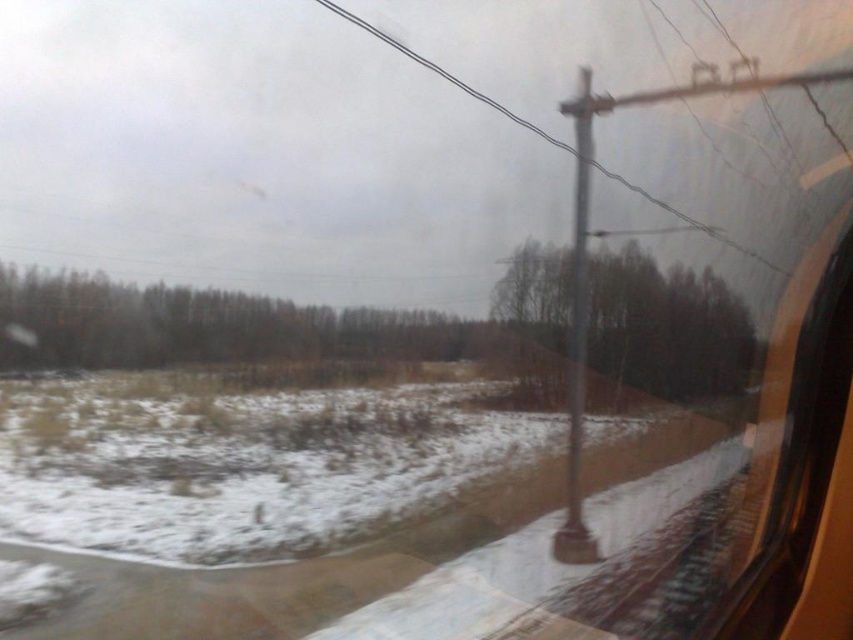
Question: Is green matte trees at center below metallic wire at center?

Choices:
 (A) no
 (B) yes

Answer: (B)

Question: Estimate the real-world distances between objects in this image. Which object is closer to the brown matte tree at center?

Choices:
 (A) metallic wire at center
 (B) green matte trees at center

Answer: (A)

Question: Which of these objects is positioned farthest from the green matte trees at center?

Choices:
 (A) brown matte tree at center
 (B) metallic wire at center

Answer: (B)

Question: Does brown matte tree at center come behind metallic wire at center?

Choices:
 (A) yes
 (B) no

Answer: (A)

Question: Estimate the real-world distances between objects in this image. Which object is farther from the green matte trees at center?

Choices:
 (A) brown matte tree at center
 (B) metallic wire at center

Answer: (B)

Question: Is green matte trees at center further to the viewer compared to metallic wire at center?

Choices:
 (A) yes
 (B) no

Answer: (A)